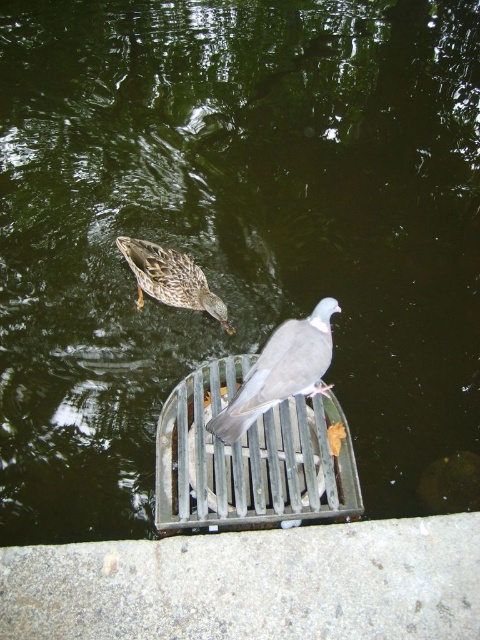
Who is positioned more to the left, gray matte pigeon at center or brown speckled feathers at upper center?

From the viewer's perspective, brown speckled feathers at upper center appears more on the left side.

Does gray matte pigeon at center lie in front of brown speckled feathers at upper center?

Yes, gray matte pigeon at center is in front of brown speckled feathers at upper center.

Does point (289, 337) lie in front of point (166, 250)?

Yes, point (289, 337) is closer to viewer.

The image size is (480, 640). I want to click on gray matte pigeon at center, so click(280, 371).